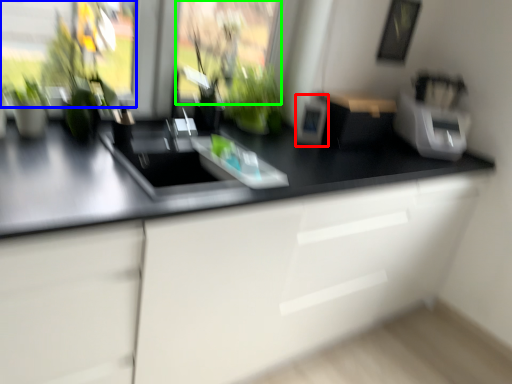
Question: Considering the real-world distances, which object is farthest from appliance (highlighted by a red box)? window screen (highlighted by a blue box) or window screen (highlighted by a green box)?

Choices:
 (A) window screen
 (B) window screen

Answer: (A)